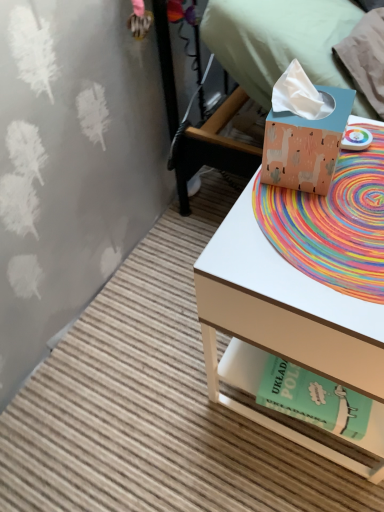
At what (x,y) coordinates should I click in order to perform the action: click on matte peach tissue box at upper right. Please return your answer as a coordinate pair (x, y). Looking at the image, I should click on (306, 144).

The height and width of the screenshot is (512, 384). Describe the element at coordinates (281, 324) in the screenshot. I see `matte cardboard tissue box at right` at that location.

This screenshot has width=384, height=512. Find the location of `matte cardboard tissue box at right`. matte cardboard tissue box at right is located at coordinates (281, 324).

Describe the element at coordinates (333, 222) in the screenshot. I see `rainbow woven mat at center` at that location.

I want to click on matte peach tissue box at upper right, so click(306, 144).

Is rainbow woven mat at center directly adjacent to matte cardboard tissue box at right?

No, rainbow woven mat at center is not in contact with matte cardboard tissue box at right.

Is rainbow woven mat at center bigger than matte cardboard tissue box at right?

No, rainbow woven mat at center is not bigger than matte cardboard tissue box at right.

Identify the location of mat lying behind the matte cardboard tissue box at right. (333, 222).

Which object is closer to the camera taking this photo, rainbow woven mat at center or matte cardboard tissue box at right?

matte cardboard tissue box at right is in front.

Would you consider matte blue tissue box at upper right to be distant from matte peach tissue box at upper right?

That's not correct — matte blue tissue box at upper right is a little close to matte peach tissue box at upper right.

Is matte blue tissue box at upper right positioned before matte peach tissue box at upper right?

No, matte blue tissue box at upper right is further to the viewer.

From the picture: Could you tell me if matte blue tissue box at upper right is facing matte peach tissue box at upper right?

No, matte blue tissue box at upper right is not aimed at matte peach tissue box at upper right.

From a real-world perspective, is matte blue tissue box at upper right physically located above or below matte peach tissue box at upper right?

matte blue tissue box at upper right is situated lower than matte peach tissue box at upper right in the real world.

Considering the relative positions of rainbow woven mat at center and matte blue tissue box at upper right in the image provided, is rainbow woven mat at center in front of matte blue tissue box at upper right?

Yes, rainbow woven mat at center is in front of matte blue tissue box at upper right.

Can you tell me how much rainbow woven mat at center and matte blue tissue box at upper right differ in facing direction?

rainbow woven mat at center and matte blue tissue box at upper right are facing 0.193 degrees away from each other.

In the scene shown: Is rainbow woven mat at center at the right side of matte blue tissue box at upper right?

No.

Does rainbow woven mat at center touch matte blue tissue box at upper right?

No, rainbow woven mat at center is not making contact with matte blue tissue box at upper right.

Considering the relative sizes of matte cardboard tissue box at right and green paper at lower right in the image provided, is matte cardboard tissue box at right taller than green paper at lower right?

Correct, matte cardboard tissue box at right is much taller as green paper at lower right.

From the image's perspective, relative to green paper at lower right, is matte cardboard tissue box at right above or below?

Clearly, from the image's perspective, matte cardboard tissue box at right is above green paper at lower right.

Considering the points (276, 260) and (298, 393), which point is behind, point (276, 260) or point (298, 393)?

The point (298, 393) is farther.

From the picture: Relative to matte cardboard tissue box at right, is matte blue tissue box at upper right in front or behind?

Clearly, matte blue tissue box at upper right is behind matte cardboard tissue box at right.

Which is more to the right, matte blue tissue box at upper right or matte cardboard tissue box at right?

matte blue tissue box at upper right is more to the right.

Does matte blue tissue box at upper right have a smaller size compared to matte cardboard tissue box at right?

Incorrect, matte blue tissue box at upper right is not smaller in size than matte cardboard tissue box at right.

From a real-world perspective, is matte cardboard tissue box at right physically located above or below matte blue tissue box at upper right?

matte cardboard tissue box at right is below matte blue tissue box at upper right.

Does point (289, 313) lie behind point (301, 59)?

That is False.

Looking at this image, considering the relative positions of matte cardboard tissue box at right and matte blue tissue box at upper right in the image provided, is matte cardboard tissue box at right to the left or to the right of matte blue tissue box at upper right?

In the image, matte cardboard tissue box at right appears on the left side of matte blue tissue box at upper right.

From the image's perspective, who appears lower, matte cardboard tissue box at right or matte blue tissue box at upper right?

matte cardboard tissue box at right is shown below in the image.

Measure the distance between matte peach tissue box at upper right and rainbow woven mat at center.

They are 3.31 inches apart.

Is point (275, 138) more distant than point (358, 252)?

Yes, it is.

From the image's perspective, is matte peach tissue box at upper right beneath rainbow woven mat at center?

Actually, matte peach tissue box at upper right appears above rainbow woven mat at center in the image.

Which is more to the right, matte peach tissue box at upper right or rainbow woven mat at center?

rainbow woven mat at center is more to the right.

You are a GUI agent. You are given a task and a screenshot of the screen. Output one action in this format:
    pyautogui.click(x=<x>, y=<y>)
    Task: Click on the mat that is above the matte cardboard tissue box at right (from the image's perspective)
    Image resolution: width=384 pixels, height=512 pixels.
    Given the screenshot: What is the action you would take?
    pyautogui.click(x=333, y=222)

Locate an element on the screen. bed below the matte peach tissue box at upper right (from a real-world perspective) is located at coordinates (301, 47).

When comparing their distances from green paper at lower right, does matte cardboard tissue box at right or matte peach tissue box at upper right seem further?

matte peach tissue box at upper right.

Based on their spatial positions, is green paper at lower right or matte cardboard tissue box at right further from matte peach tissue box at upper right?

Among the two, green paper at lower right is located further to matte peach tissue box at upper right.

Considering their positions, is green paper at lower right positioned further to matte peach tissue box at upper right than rainbow woven mat at center?

green paper at lower right is positioned further to the anchor matte peach tissue box at upper right.

Which object lies nearer to the anchor point rainbow woven mat at center, matte blue tissue box at upper right or matte cardboard tissue box at right?

matte cardboard tissue box at right lies closer to rainbow woven mat at center than the other object.

From the image, which object appears to be farther from matte blue tissue box at upper right, rainbow woven mat at center or matte peach tissue box at upper right?

matte peach tissue box at upper right lies further to matte blue tissue box at upper right than the other object.

Based on the photo, from the image, which object appears to be nearer to green paper at lower right, rainbow woven mat at center or matte cardboard tissue box at right?

Among the two, matte cardboard tissue box at right is located nearer to green paper at lower right.

When comparing their distances from rainbow woven mat at center, does matte peach tissue box at upper right or matte cardboard tissue box at right seem closer?

matte peach tissue box at upper right is closer to rainbow woven mat at center.

Estimate the real-world distances between objects in this image. Which object is closer to matte cardboard tissue box at right, matte blue tissue box at upper right or matte peach tissue box at upper right?

matte peach tissue box at upper right.

In order to click on box between matte blue tissue box at upper right and green paper at lower right from top to bottom in this screenshot , I will do `click(306, 144)`.

Where is `mat between matte blue tissue box at upper right and matte cardboard tissue box at right in the vertical direction`? The height and width of the screenshot is (512, 384). mat between matte blue tissue box at upper right and matte cardboard tissue box at right in the vertical direction is located at coordinates (333, 222).

The height and width of the screenshot is (512, 384). I want to click on desk that lies between matte peach tissue box at upper right and green paper at lower right from top to bottom, so tap(281, 324).

Where is `desk between rainbow woven mat at center and green paper at lower right in the vertical direction`? The height and width of the screenshot is (512, 384). desk between rainbow woven mat at center and green paper at lower right in the vertical direction is located at coordinates (281, 324).